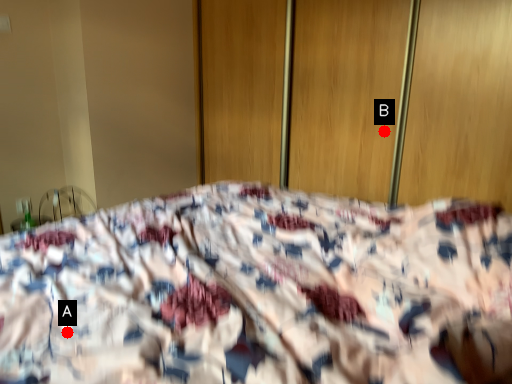
Question: Two points are circled on the image, labeled by A and B beside each circle. Which point is farther from the camera taking this photo?

Choices:
 (A) A is further
 (B) B is further

Answer: (B)